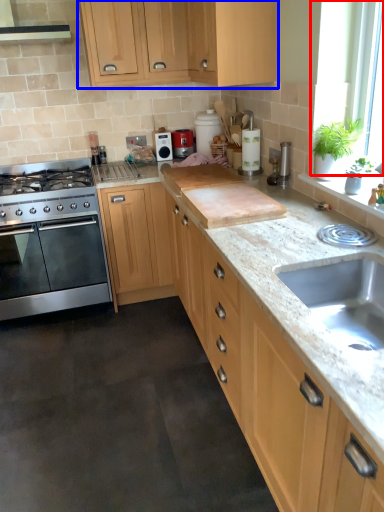
Question: Which point is closer to the camera, window screen (highlighted by a red box) or cabinetry (highlighted by a blue box)?

Choices:
 (A) window screen
 (B) cabinetry

Answer: (A)